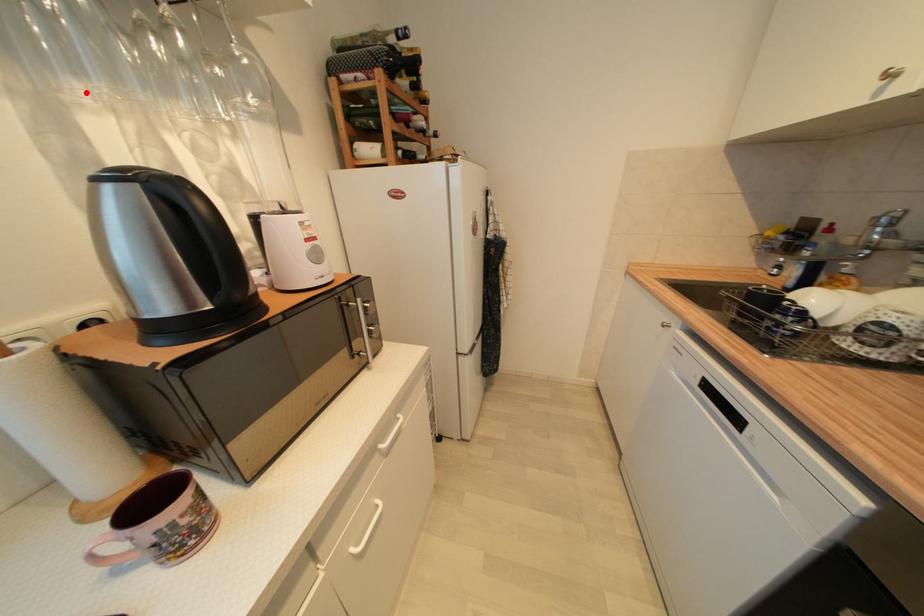
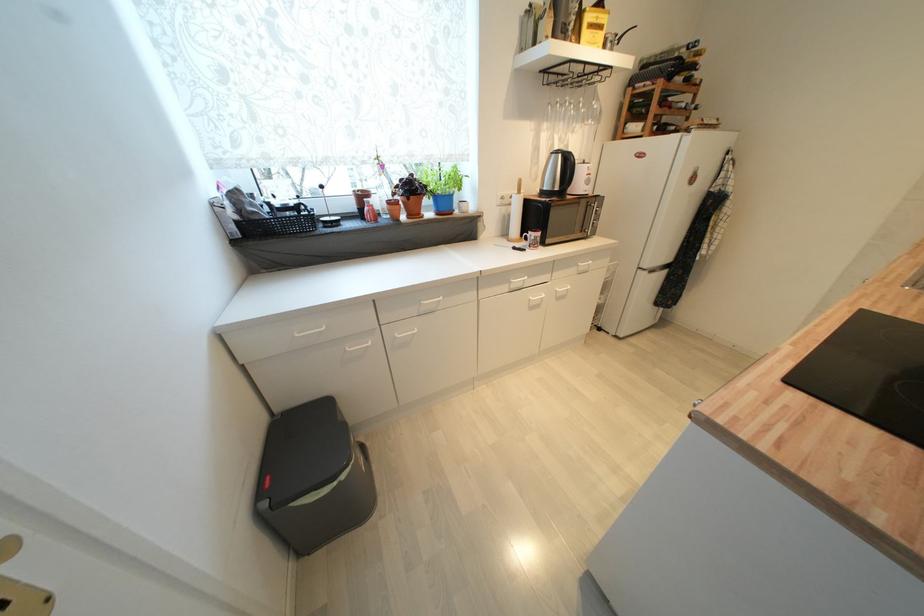
In the second image, find the point that corresponds to the highlighted location in the first image.

(551, 127)